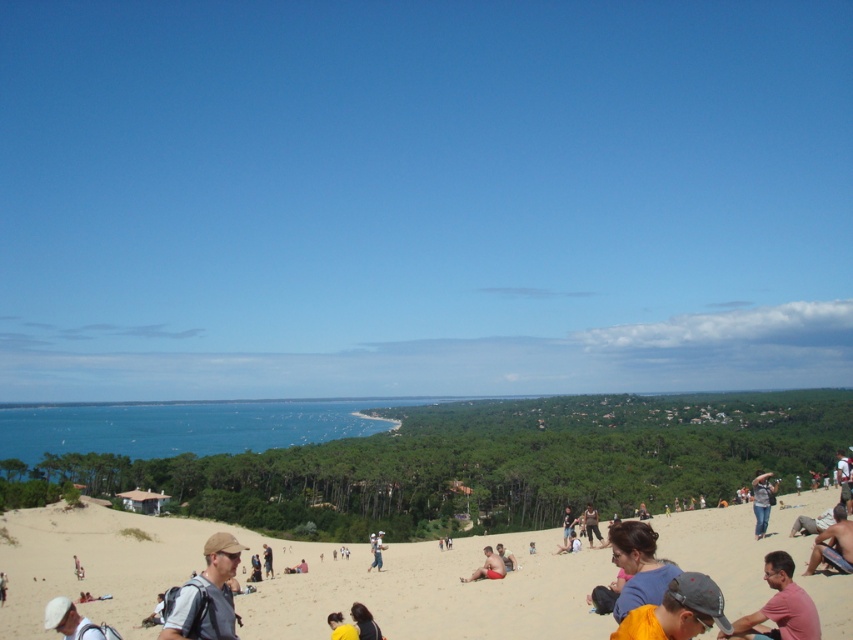
Question: Is denim jeans at lower right positioned at the back of red fabric shorts at center?

Choices:
 (A) yes
 (B) no

Answer: (B)

Question: Which point is farther to the camera?

Choices:
 (A) click(x=793, y=596)
 (B) click(x=758, y=500)
 (C) click(x=335, y=632)
 (D) click(x=679, y=627)

Answer: (B)

Question: Where is matte white cap at lower left located in relation to denim jeans at lower right in the image?

Choices:
 (A) above
 (B) below

Answer: (A)

Question: Considering the real-world distances, which object is closest to the beige sandy beach at lower center?

Choices:
 (A) light blue denim shorts at center
 (B) red fabric shorts at center
 (C) matte white cap at lower left
 (D) light brown sand at lower center

Answer: (A)

Question: Does light blue denim shorts at center come behind beige sand at lower center?

Choices:
 (A) yes
 (B) no

Answer: (A)

Question: Which object is the closest to the beige sand at lower center?

Choices:
 (A) yellow fabric at lower center
 (B) smooth tan skin at lower right

Answer: (A)